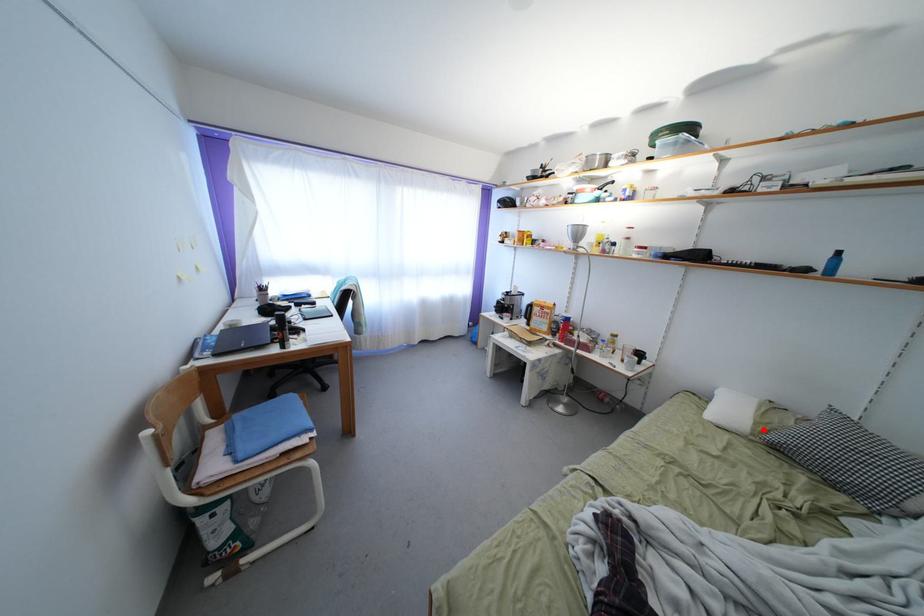
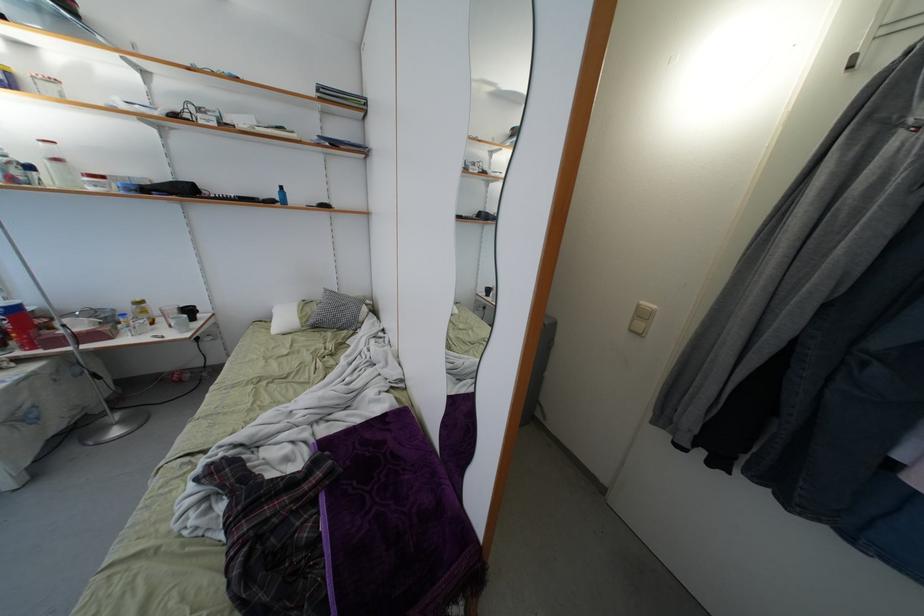
Find the pixel in the second image that matches the highlighted location in the first image.

(306, 323)